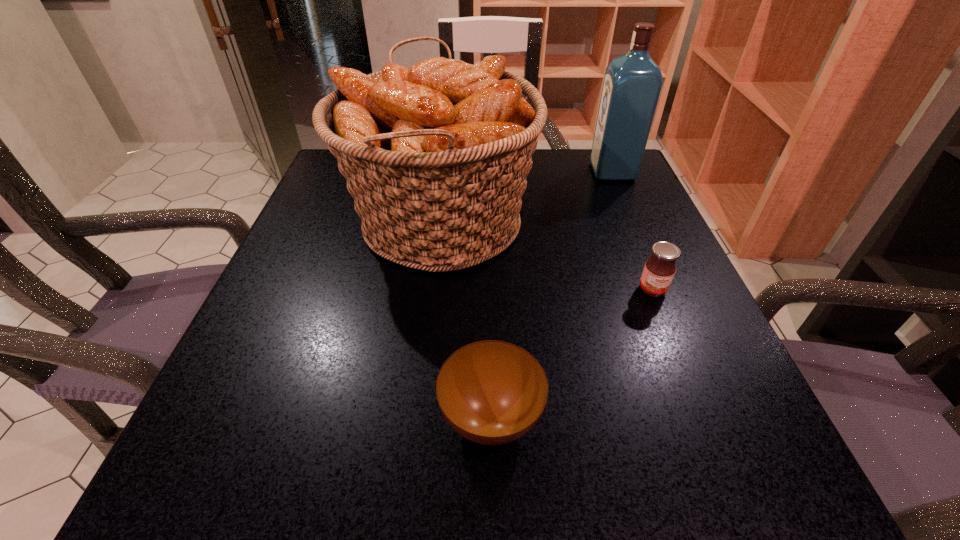
Image resolution: width=960 pixels, height=540 pixels. What are the coordinates of `blank space located on the back of the nearest object` in the screenshot? It's located at (489, 295).

This screenshot has width=960, height=540. I want to click on liquor that is at the far edge, so click(x=632, y=84).

At what (x,y) coordinates should I click in order to perform the action: click on basket that is at the far edge. Please return your answer as a coordinate pair (x, y). Looking at the image, I should click on (436, 155).

At what (x,y) coordinates should I click in order to perform the action: click on object at the near edge. Please return your answer as a coordinate pair (x, y). Image resolution: width=960 pixels, height=540 pixels. Looking at the image, I should click on (491, 392).

Where is `object at the left edge`? The width and height of the screenshot is (960, 540). object at the left edge is located at coordinates (436, 155).

The height and width of the screenshot is (540, 960). In order to click on liquor present at the right edge in this screenshot , I will do `click(632, 84)`.

Locate an element on the screen. This screenshot has width=960, height=540. jam that is positioned at the right edge is located at coordinates coord(659,270).

Identify the location of object that is at the far left corner. (436, 155).

Identify the location of object that is at the far right corner. The image size is (960, 540). (632, 84).

In the image, there is a desktop. Identify the location of vacant region at the near edge. This screenshot has height=540, width=960. [x=386, y=511].